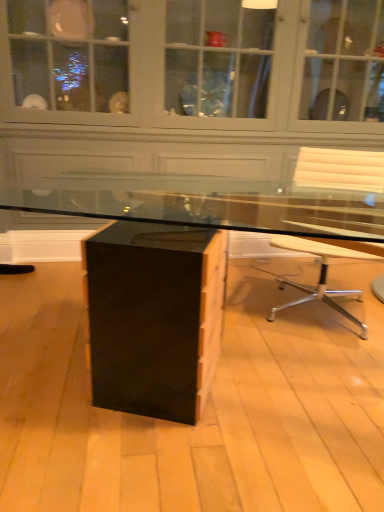
The height and width of the screenshot is (512, 384). What are the coordinates of `vacant space to the left of matte black desk at center` in the screenshot? It's located at (54, 388).